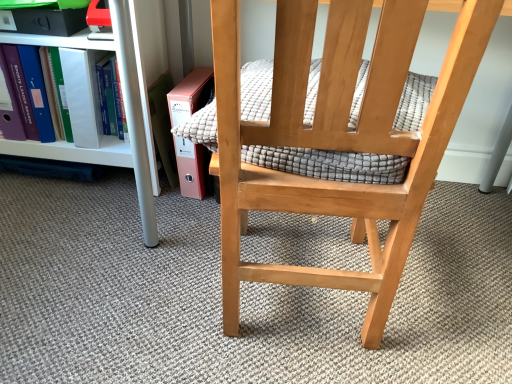
Question: From a real-world perspective, is pink cardboard book at lower left located beneath natural wood chair at center?

Choices:
 (A) yes
 (B) no

Answer: (A)

Question: Considering the relative sizes of pink cardboard book at lower left and natural wood chair at center in the image provided, is pink cardboard book at lower left taller than natural wood chair at center?

Choices:
 (A) no
 (B) yes

Answer: (A)

Question: Does pink cardboard book at lower left come behind natural wood chair at center?

Choices:
 (A) yes
 (B) no

Answer: (A)

Question: Is pink cardboard book at lower left shorter than natural wood chair at center?

Choices:
 (A) yes
 (B) no

Answer: (A)

Question: From a real-world perspective, is pink cardboard book at lower left located higher than natural wood chair at center?

Choices:
 (A) yes
 (B) no

Answer: (B)

Question: Is pink cardboard book at lower left aimed at natural wood chair at center?

Choices:
 (A) yes
 (B) no

Answer: (B)

Question: Is pink cardboard book at lower left at the back of white plastic shelf at left?

Choices:
 (A) no
 (B) yes

Answer: (A)

Question: Does white plastic shelf at left appear on the right side of pink cardboard book at lower left?

Choices:
 (A) yes
 (B) no

Answer: (B)

Question: Can pink cardboard book at lower left be found inside white plastic shelf at left?

Choices:
 (A) yes
 (B) no

Answer: (A)

Question: Considering the relative sizes of white plastic shelf at left and pink cardboard book at lower left in the image provided, is white plastic shelf at left smaller than pink cardboard book at lower left?

Choices:
 (A) no
 (B) yes

Answer: (A)

Question: Is white plastic shelf at left completely or partially outside of pink cardboard book at lower left?

Choices:
 (A) yes
 (B) no

Answer: (A)

Question: Does white plastic shelf at left appear on the left side of pink cardboard book at lower left?

Choices:
 (A) yes
 (B) no

Answer: (A)

Question: Does textured gray quilt at center have a greater width compared to white plastic shelf at left?

Choices:
 (A) no
 (B) yes

Answer: (A)